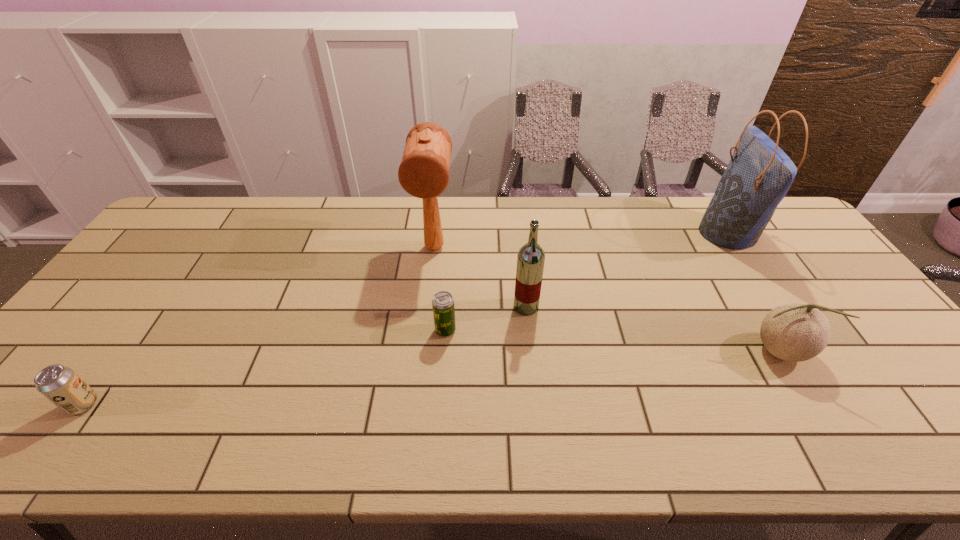
The height and width of the screenshot is (540, 960). Identify the location of free region at the near edge. (559, 448).

In the image, there is a desktop. Where is `vacant space at the left edge`? The image size is (960, 540). vacant space at the left edge is located at coordinates (76, 346).

Find the location of a particular element. Image resolution: width=960 pixels, height=540 pixels. vacant space at the right edge of the desktop is located at coordinates (824, 284).

What are the coordinates of `free space at the near right corner` in the screenshot? It's located at (940, 435).

In order to click on empty location between the mallet and the cantaloup in this screenshot , I will do `click(607, 299)`.

Locate an element on the screen. free space between the fourth object from left to right and the shopping bag is located at coordinates (627, 271).

The image size is (960, 540). I want to click on free area in between the shopping bag and the cantaloup, so click(753, 292).

This screenshot has width=960, height=540. I want to click on vacant area between the liquor and the mallet, so click(480, 277).

At what (x,y) coordinates should I click in order to perform the action: click on empty space between the mallet and the farther beer can. Please return your answer as a coordinate pair (x, y). Looking at the image, I should click on pos(440,289).

Where is `vacant space in between the fourth tallest object and the shopping bag`? vacant space in between the fourth tallest object and the shopping bag is located at coordinates (753, 292).